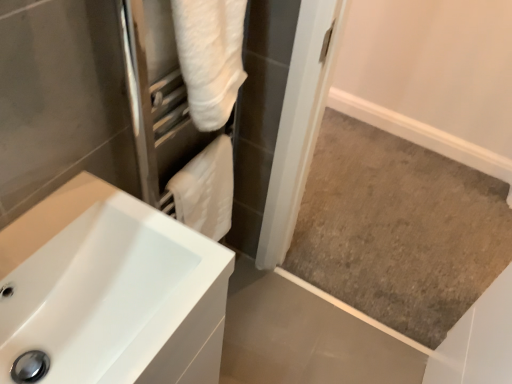
Question: Does white glossy sink at lower left appear on the right side of white fluffy towel at upper center?

Choices:
 (A) no
 (B) yes

Answer: (A)

Question: Is white glossy sink at lower left wider than white fluffy towel at upper center?

Choices:
 (A) no
 (B) yes

Answer: (B)

Question: Can you confirm if white glossy sink at lower left is shorter than white fluffy towel at upper center?

Choices:
 (A) yes
 (B) no

Answer: (B)

Question: Considering the relative sizes of white glossy sink at lower left and white fluffy towel at upper center in the image provided, is white glossy sink at lower left bigger than white fluffy towel at upper center?

Choices:
 (A) yes
 (B) no

Answer: (A)

Question: Does white glossy sink at lower left come in front of white fluffy towel at upper center?

Choices:
 (A) yes
 (B) no

Answer: (A)

Question: From the image's perspective, is white fluffy towel at upper center located above or below white glossy sink at lower left?

Choices:
 (A) below
 (B) above

Answer: (B)

Question: Considering the positions of white fluffy towel at upper center and white glossy sink at lower left in the image, is white fluffy towel at upper center bigger or smaller than white glossy sink at lower left?

Choices:
 (A) small
 (B) big

Answer: (A)

Question: Considering the relative positions of white fluffy towel at upper center and white glossy sink at lower left in the image provided, is white fluffy towel at upper center to the left or to the right of white glossy sink at lower left?

Choices:
 (A) right
 (B) left

Answer: (A)

Question: In terms of height, does white fluffy towel at upper center look taller or shorter compared to white glossy sink at lower left?

Choices:
 (A) tall
 (B) short

Answer: (B)

Question: Is point (79, 206) closer or farther from the camera than point (212, 233)?

Choices:
 (A) closer
 (B) farther

Answer: (A)

Question: From their relative heights in the image, would you say white glossy sink at lower left is taller or shorter than white soft towel at center?

Choices:
 (A) short
 (B) tall

Answer: (B)

Question: Is white glossy sink at lower left wider or thinner than white soft towel at center?

Choices:
 (A) thin
 (B) wide

Answer: (B)

Question: From the image's perspective, is white glossy sink at lower left above or below white soft towel at center?

Choices:
 (A) below
 (B) above

Answer: (A)

Question: In terms of width, does white glossy sink at lower left look wider or thinner when compared to white fluffy towel at upper center?

Choices:
 (A) wide
 (B) thin

Answer: (A)

Question: Based on their positions, is white glossy sink at lower left located to the left or right of white fluffy towel at upper center?

Choices:
 (A) left
 (B) right

Answer: (A)